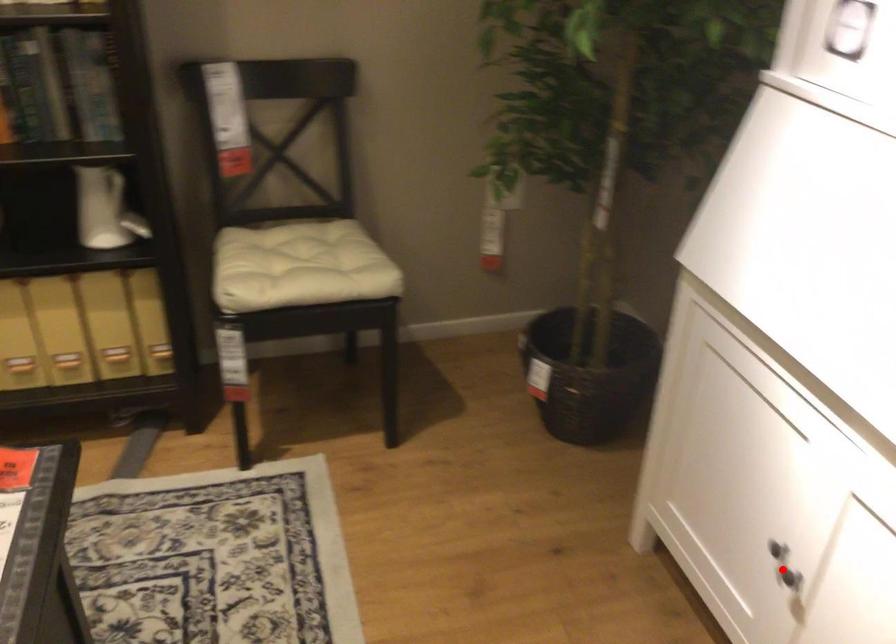
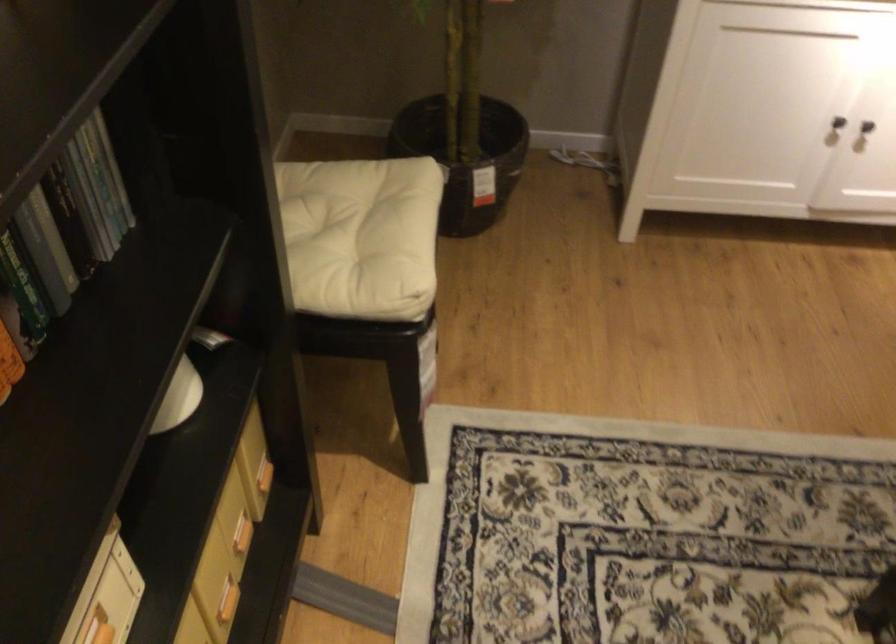
Question: I am providing you with two images of the same scene from different viewpoints. Given a red point in image1, look at the same physical point in image2. Is it:

Choices:
 (A) Closer to the viewpoint
 (B) Farther from the viewpoint

Answer: (B)